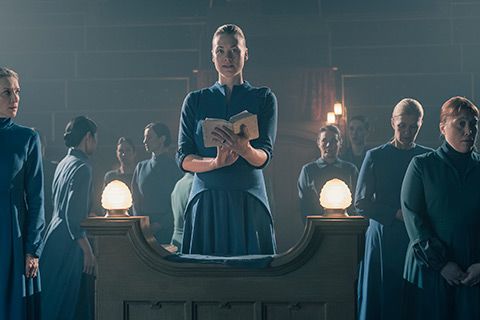
Locate an element on the screen. This screenshot has width=480, height=320. book is located at coordinates (205, 126).